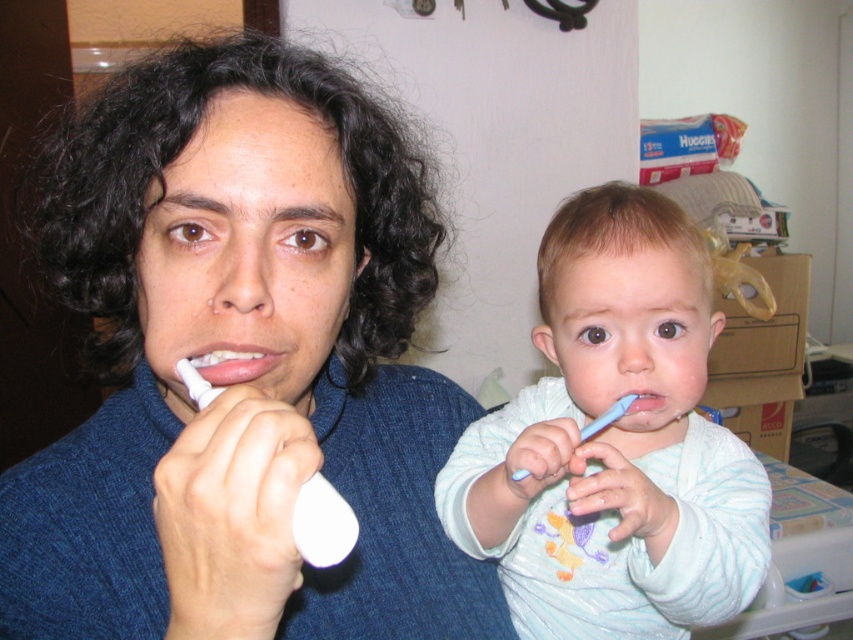
You are a robot trying to navigate between two points in a bathroom. The first point is point (614, 593) and the second point is point (531, 472). According to the scene, which point is closer to the observer?

Point (531, 472) is closer to the observer because the Objects Description states that point (614, 593) is behind point (531, 472).

You need to choose a toothbrush that can fit into a narrow space between two bathroom items. Based on the image, which one between the white soft toothbrush at right and the blue plastic toothbrush at center would you recommend?

The blue plastic toothbrush at center is narrower than the white soft toothbrush at right, so it would fit better in a narrow space between two bathroom items.

You are a parent trying to choose a toothbrush for your child. You have two options in the bathroom, the white soft toothbrush at right and the white plastic toothbrush at left. Which one has a wider bristle area to cover more teeth surfaces?

The white soft toothbrush at right has a larger width than the white plastic toothbrush at left, so it has a wider bristle area to cover more teeth surfaces.